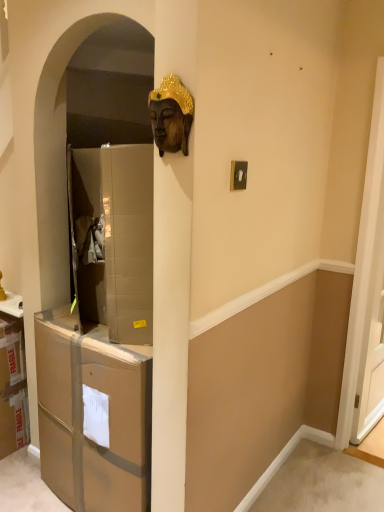
Question: Is bronze statue at upper center bigger than brown cardboard drawer at left?

Choices:
 (A) yes
 (B) no

Answer: (B)

Question: Is bronze statue at upper center thinner than brown cardboard drawer at left?

Choices:
 (A) yes
 (B) no

Answer: (A)

Question: Is bronze statue at upper center looking in the opposite direction of brown cardboard drawer at left?

Choices:
 (A) yes
 (B) no

Answer: (B)

Question: Is bronze statue at upper center taller than brown cardboard drawer at left?

Choices:
 (A) no
 (B) yes

Answer: (A)

Question: From a real-world perspective, does bronze statue at upper center stand above brown cardboard drawer at left?

Choices:
 (A) no
 (B) yes

Answer: (B)

Question: Is white glossy screen door at right wider or thinner than brown cardboard drawer at left?

Choices:
 (A) wide
 (B) thin

Answer: (B)

Question: Is white glossy screen door at right taller or shorter than brown cardboard drawer at left?

Choices:
 (A) short
 (B) tall

Answer: (B)

Question: From the image's perspective, relative to brown cardboard drawer at left, is white glossy screen door at right above or below?

Choices:
 (A) below
 (B) above

Answer: (B)

Question: Does point (382, 261) appear closer or farther from the camera than point (71, 391)?

Choices:
 (A) closer
 (B) farther

Answer: (B)

Question: Considering the positions of white glossy screen door at right and bronze statue at upper center in the image, is white glossy screen door at right bigger or smaller than bronze statue at upper center?

Choices:
 (A) small
 (B) big

Answer: (B)

Question: Do you think white glossy screen door at right is within bronze statue at upper center, or outside of it?

Choices:
 (A) inside
 (B) outside

Answer: (B)

Question: From the image's perspective, is white glossy screen door at right located above or below bronze statue at upper center?

Choices:
 (A) above
 (B) below

Answer: (B)

Question: From their relative heights in the image, would you say white glossy screen door at right is taller or shorter than bronze statue at upper center?

Choices:
 (A) short
 (B) tall

Answer: (B)

Question: Is brown cardboard drawer at left inside or outside of white glossy screen door at right?

Choices:
 (A) outside
 (B) inside

Answer: (A)

Question: Based on their sizes in the image, would you say brown cardboard drawer at left is bigger or smaller than white glossy screen door at right?

Choices:
 (A) big
 (B) small

Answer: (A)